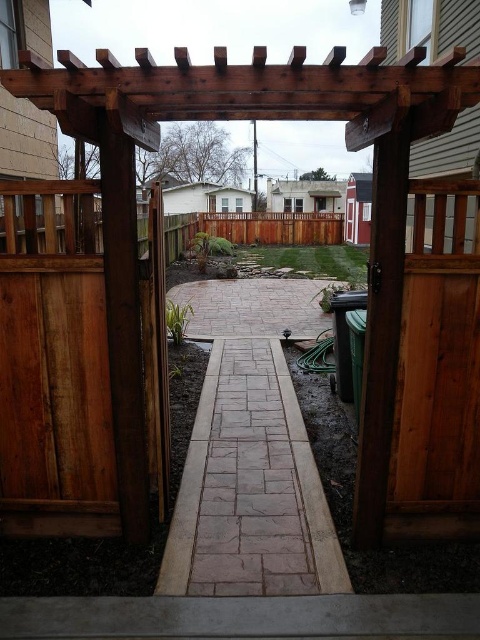
Based on the photo, you are standing at the open wooden gate and want to place a small garden ornament exactly halfway between the point at [190,588] and the point at [235,212]. Which direction should you walk from the gate to reach the midpoint?

Since point [190,588] is closer to the camera than point [235,212], the midpoint would be closer to the farther point. Therefore, you should walk towards the grassy area in the background to place the ornament at the midpoint between the two points.

You are standing outside the gate looking into the backyard. You see the brown stone path at center and the brown wooden fence at center. Which one is closer to the ground?

The brown stone path at center is closer to the ground because it is located below the brown wooden fence at center.